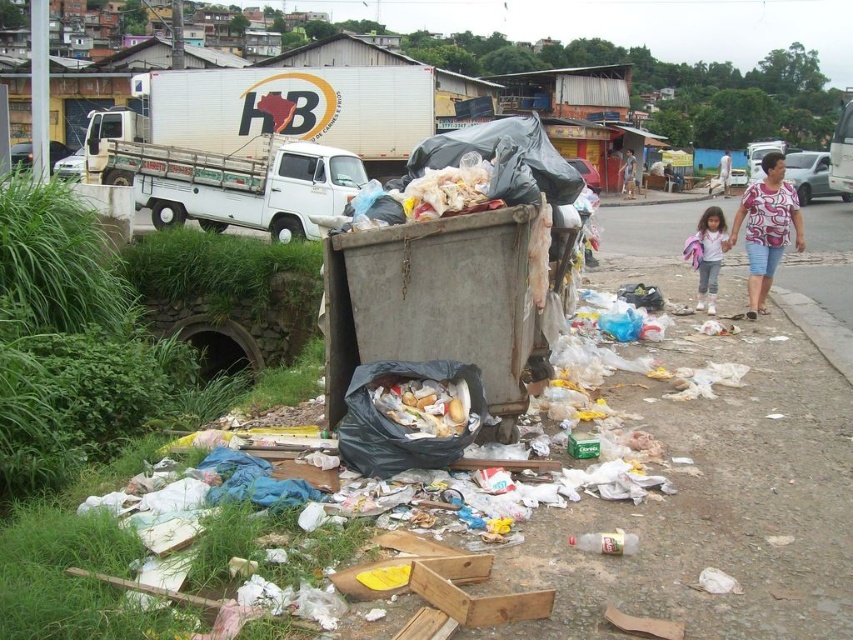
Does white matte truck at upper center appear over white printed shirt at right?

Yes, white matte truck at upper center is above white printed shirt at right.

Between point (193, 109) and point (737, 212), which one is positioned behind?

Positioned behind is point (193, 109).

Measure the distance between white matte truck at upper center and camera.

white matte truck at upper center and camera are 17.02 meters apart.

I want to click on white matte truck at upper center, so click(x=271, y=113).

Which of these two, white printed shirt at right or light brown shorts at lower right, stands shorter?

Standing shorter between the two is white printed shirt at right.

Is point (785, 225) positioned after point (724, 154)?

No, it is in front of (724, 154).

Identify the location of white printed shirt at right. (766, 227).

Is white matte truck at upper center bigger than white matte truck at left?

Yes, white matte truck at upper center is bigger than white matte truck at left.

Between white matte truck at upper center and white matte truck at left, which one is positioned higher?

white matte truck at upper center is above.

Is point (425, 128) positioned in front of point (334, 173)?

No, it is behind (334, 173).

This screenshot has width=853, height=640. I want to click on white matte truck at upper center, so click(271, 113).